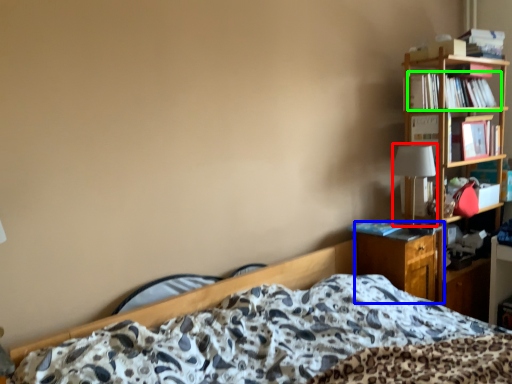
Question: Which is farther away from table lamp (highlighted by a red box)? nightstand (highlighted by a blue box) or book (highlighted by a green box)?

Choices:
 (A) nightstand
 (B) book

Answer: (B)